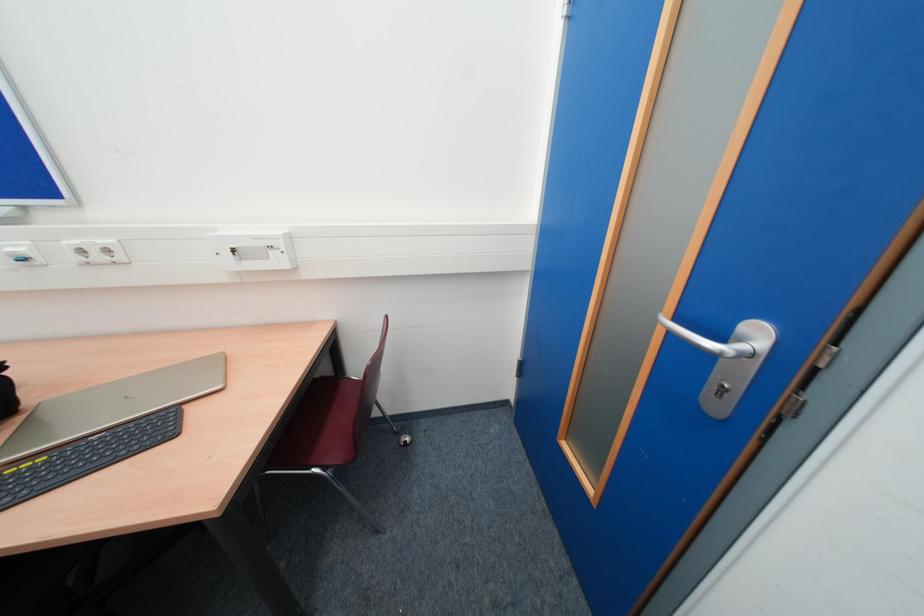
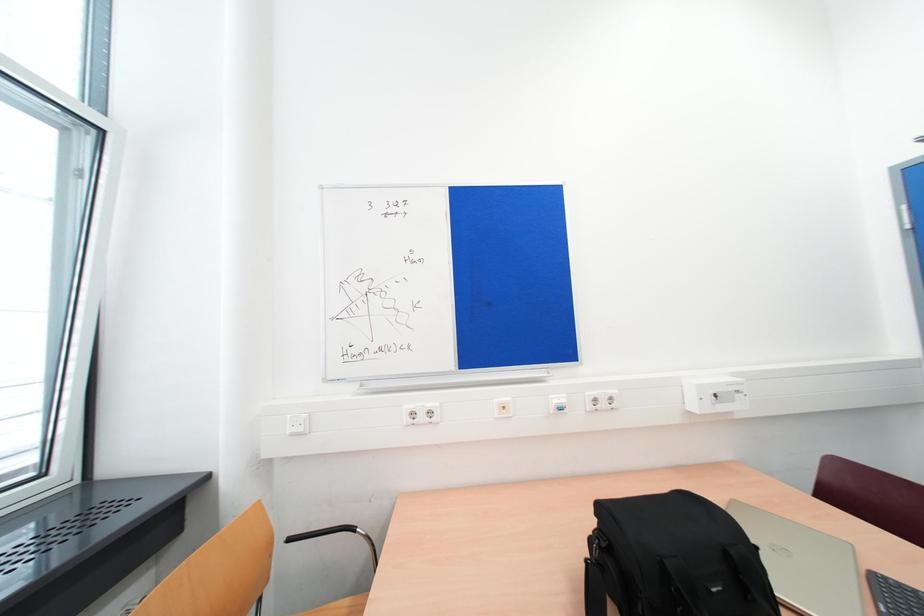
Question: What movement of the cameraman would produce the second image?

Choices:
 (A) Left
 (B) Right
 (C) Forward
 (D) Backward

Answer: (A)